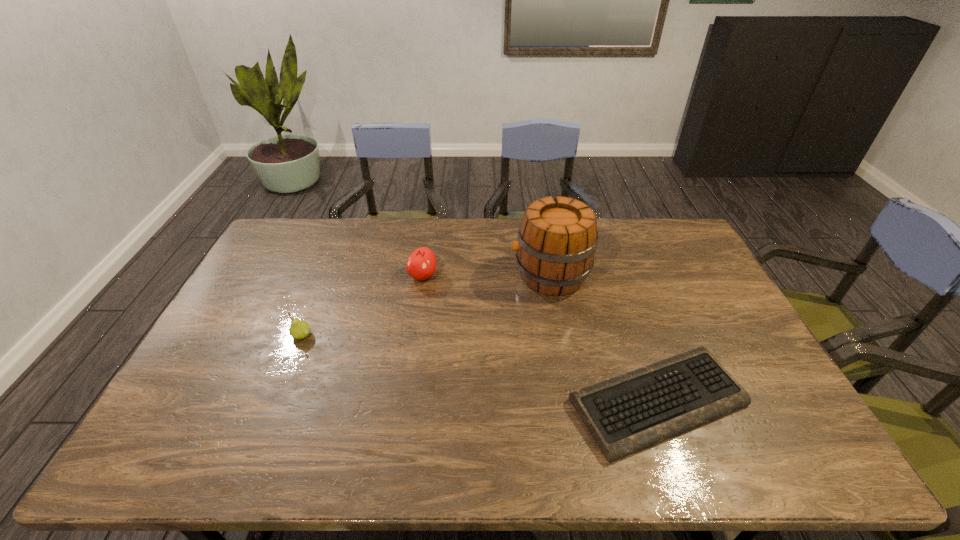
Locate an element on the screen. This screenshot has height=540, width=960. free spot between the shortest object and the second object from left to right is located at coordinates (540, 339).

The image size is (960, 540). I want to click on vacant area that lies between the cider and the computer keyboard, so click(604, 339).

Identify the location of object identified as the third closest to the third object from right to left. Image resolution: width=960 pixels, height=540 pixels. (625, 414).

At what (x,y) coordinates should I click in order to perform the action: click on the third closest object to the third shortest object. Please return your answer as a coordinate pair (x, y). The width and height of the screenshot is (960, 540). Looking at the image, I should click on (625, 414).

Find the location of a particular element. Image resolution: width=960 pixels, height=540 pixels. vacant area that satisfies the following two spatial constraints: 1. on the side of the cider where the spigot is located; 2. on the left side of the nearest object is located at coordinates (573, 402).

The width and height of the screenshot is (960, 540). What are the coordinates of `free space that satisfies the following two spatial constraints: 1. on the side of the cider where the spigot is located; 2. on the front side of the third farthest object` in the screenshot? It's located at (561, 335).

Find the location of a particular element. vacant space that satisfies the following two spatial constraints: 1. on the side of the tallest object where the spigot is located; 2. on the left side of the computer keyboard is located at coordinates (573, 402).

What are the coordinates of `vacant space that satisfies the following two spatial constraints: 1. on the side of the nearest object where the spigot is located; 2. on the right side of the tallest object` in the screenshot? It's located at (573, 402).

In order to click on vacant area that satisfies the following two spatial constraints: 1. on the back side of the nearest object; 2. on the side of the tallest object where the spigot is located in this screenshot , I will do `click(613, 275)`.

Where is `free space that satisfies the following two spatial constraints: 1. on the side of the shortest object where the spigot is located; 2. on the right side of the tallest object`? free space that satisfies the following two spatial constraints: 1. on the side of the shortest object where the spigot is located; 2. on the right side of the tallest object is located at coordinates (573, 402).